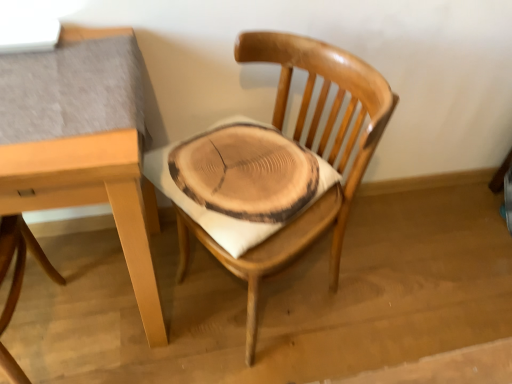
Question: From the image's perspective, is natural wood chair at center, which is the first chair from left to right, below wooden chair at center, placed as the 1th chair when sorted from right to left?

Choices:
 (A) no
 (B) yes

Answer: (B)

Question: From a real-world perspective, is natural wood chair at center, which is the first chair from left to right, over wooden chair at center, placed as the 1th chair when sorted from right to left?

Choices:
 (A) yes
 (B) no

Answer: (B)

Question: Is natural wood chair at center, positioned as the second chair in right-to-left order, at the left side of wooden chair at center, which appears as the second chair when viewed from the left?

Choices:
 (A) no
 (B) yes

Answer: (B)

Question: From a real-world perspective, is natural wood chair at center, positioned as the second chair in right-to-left order, beneath wooden chair at center, placed as the 1th chair when sorted from right to left?

Choices:
 (A) no
 (B) yes

Answer: (B)

Question: Considering the relative sizes of natural wood chair at center, positioned as the second chair in right-to-left order, and wooden chair at center, which appears as the second chair when viewed from the left, in the image provided, is natural wood chair at center, positioned as the second chair in right-to-left order, shorter than wooden chair at center, which appears as the second chair when viewed from the left,?

Choices:
 (A) no
 (B) yes

Answer: (B)

Question: Are natural wood chair at center, which is the first chair from left to right, and wooden chair at center, which appears as the second chair when viewed from the left, beside each other?

Choices:
 (A) yes
 (B) no

Answer: (B)

Question: Is natural wood chair at center, positioned as the second chair in right-to-left order, smaller than light brown wood table at upper left?

Choices:
 (A) yes
 (B) no

Answer: (A)

Question: From a real-world perspective, does natural wood chair at center, which is the first chair from left to right, sit lower than light brown wood table at upper left?

Choices:
 (A) no
 (B) yes

Answer: (B)

Question: Considering the relative sizes of natural wood chair at center, positioned as the second chair in right-to-left order, and light brown wood table at upper left in the image provided, is natural wood chair at center, positioned as the second chair in right-to-left order, shorter than light brown wood table at upper left?

Choices:
 (A) yes
 (B) no

Answer: (A)

Question: Can you confirm if natural wood chair at center, which is the first chair from left to right, is bigger than light brown wood table at upper left?

Choices:
 (A) no
 (B) yes

Answer: (A)

Question: Is natural wood chair at center, which is the first chair from left to right, aimed at light brown wood table at upper left?

Choices:
 (A) no
 (B) yes

Answer: (B)

Question: From the image's perspective, is natural wood chair at center, which is the first chair from left to right, on top of light brown wood table at upper left?

Choices:
 (A) no
 (B) yes

Answer: (A)

Question: Is the surface of light brown wood table at upper left in direct contact with wooden chair at center, placed as the 1th chair when sorted from right to left?

Choices:
 (A) no
 (B) yes

Answer: (A)